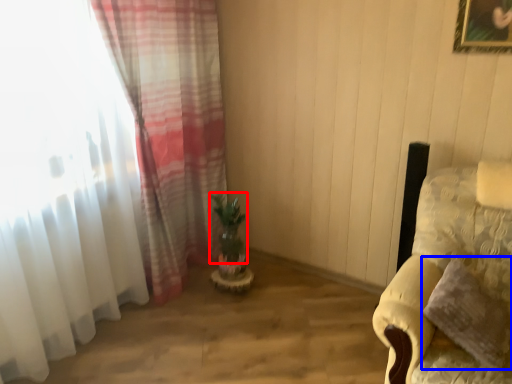
Question: Which object appears closest to the camera in this image, plant (highlighted by a red box) or pillow (highlighted by a blue box)?

Choices:
 (A) plant
 (B) pillow

Answer: (B)